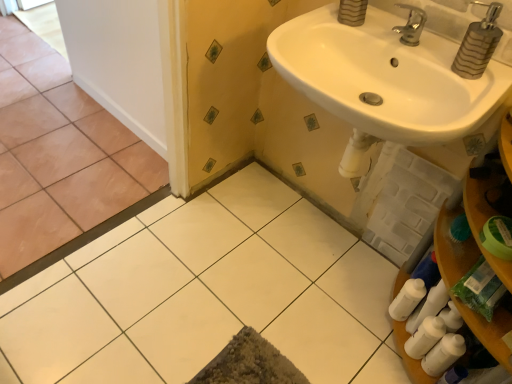
This screenshot has width=512, height=384. In order to click on free space that is in between silver metallic faucet at upper right and metallic striped soap dispenser at upper right in this screenshot , I will do `click(435, 60)`.